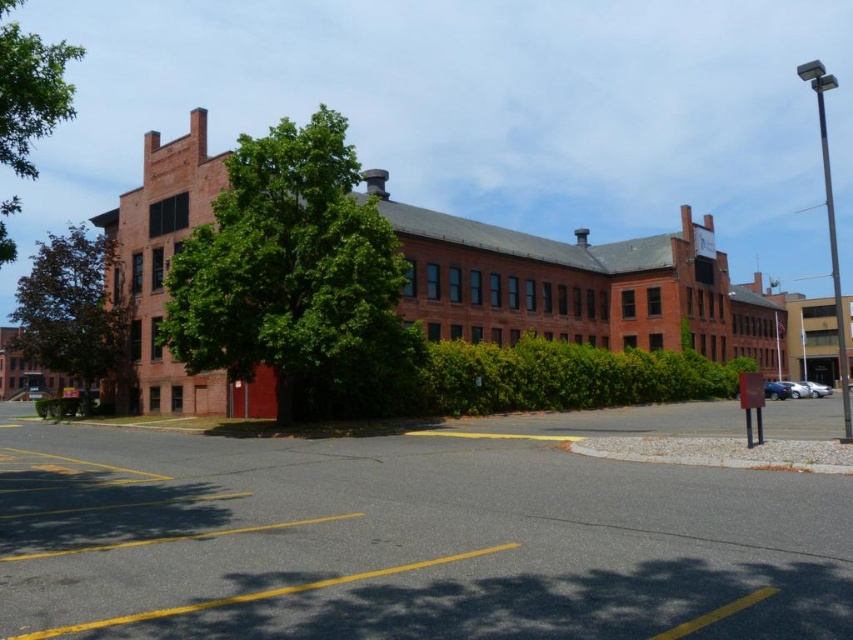
You are a gardener planning to plant a new tree in the parking lot of the building. You notice the green leafy tree at center and the green leafy tree at upper left. Which tree takes up more space in the parking lot area?

The green leafy tree at upper left takes up more space in the parking lot area than the green leafy tree at center.

You are a gardener planning to plant a new tree in the parking lot. You want to choose between the two existing green leafy tree at center and green leafy tree at left. Which tree has a wider canopy to provide more shade?

The green leafy tree at left has a wider canopy than the green leafy tree at center, so it would provide more shade.

You are standing at the entrance of the building and want to plant a new tree exactly at point (291, 275). Is there already a tree at that location?

Yes, there is already a green leafy tree at center located at point (291, 275).